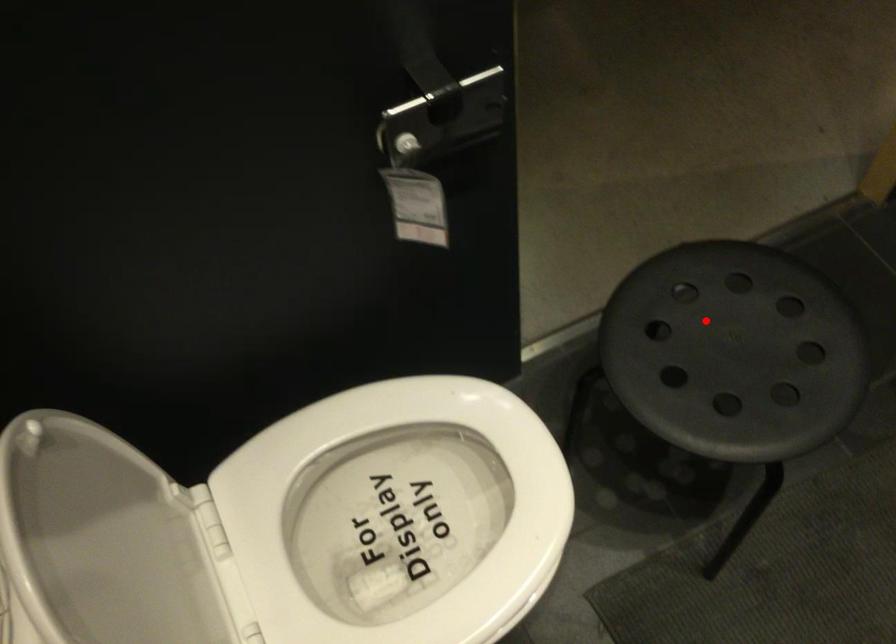
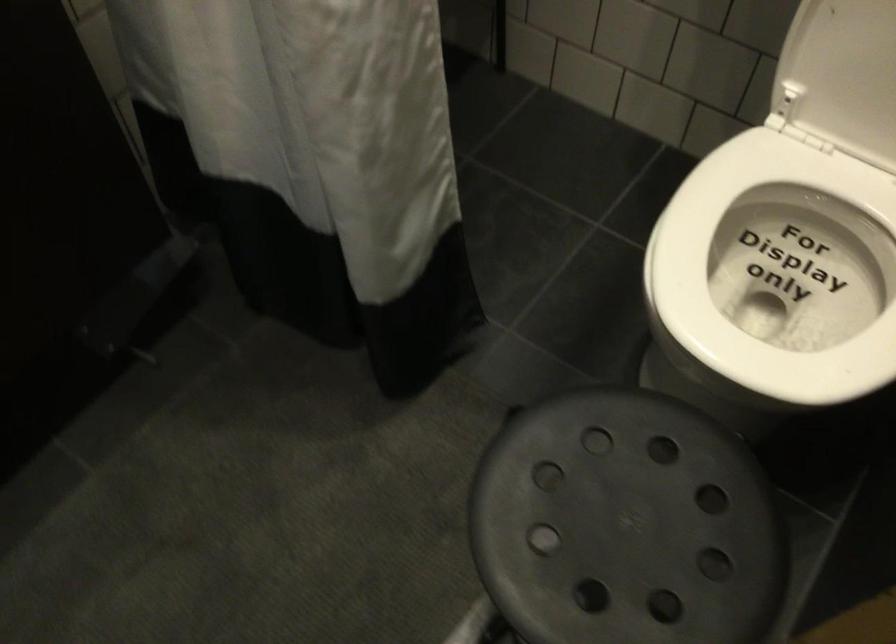
Locate, in the second image, the point that corresponds to the highlighted location in the first image.

(625, 525)